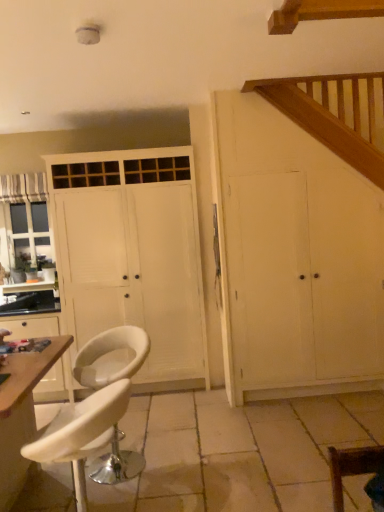
Find the location of a particular element. The width and height of the screenshot is (384, 512). unoccupied space behind white leather bar stool at lower left, which appears as the first chair when viewed from the left is located at coordinates (150, 430).